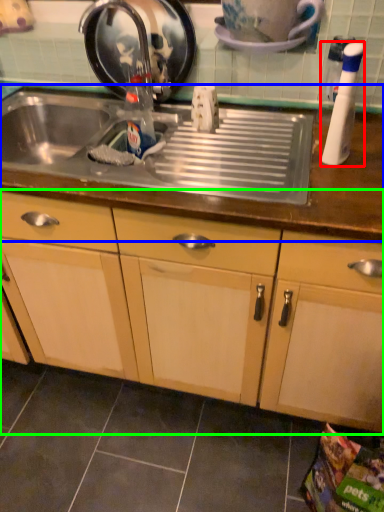
Question: Based on their relative distances, which object is farther from bottle (highlighted by a red box)? Choose from countertop (highlighted by a blue box) and cabinetry (highlighted by a green box).

Choices:
 (A) countertop
 (B) cabinetry

Answer: (B)